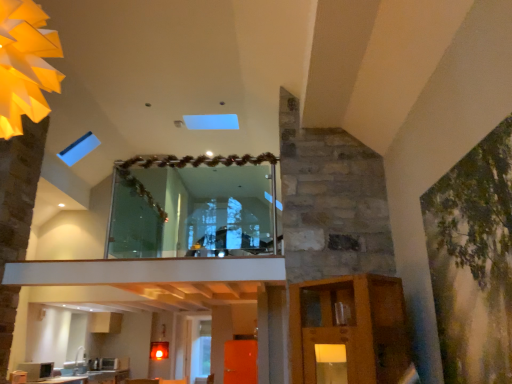
Question: Is matte black microwave at lower left spatially inside green matte painting at right, or outside of it?

Choices:
 (A) inside
 (B) outside

Answer: (B)

Question: In terms of size, does matte black microwave at lower left appear bigger or smaller than green matte painting at right?

Choices:
 (A) small
 (B) big

Answer: (A)

Question: Estimate the real-world distances between objects in this image. Which object is closer to the green matte painting at right?

Choices:
 (A) transparent glass door at center
 (B) transparent glass window at center
 (C) matte black microwave at lower left
 (D) white glossy countertop at lower left
 (E) matte yellow paper light at upper left

Answer: (E)

Question: Which object is positioned closest to the matte yellow paper light at upper left?

Choices:
 (A) matte black microwave at lower left
 (B) green matte painting at right
 (C) white glossy countertop at lower left
 (D) transparent glass door at center
 (E) transparent glass window at center

Answer: (B)